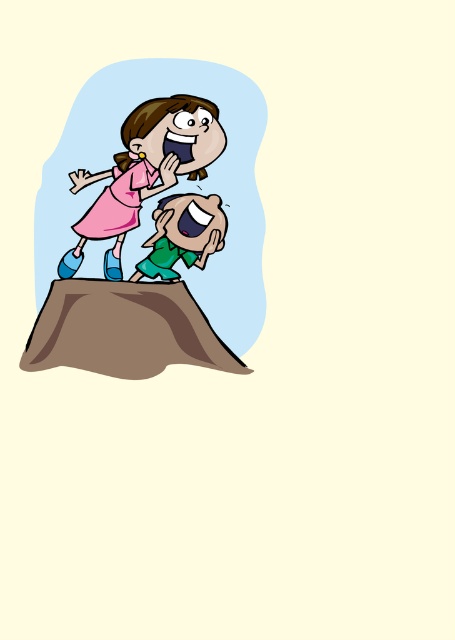
From the picture: Does pink fabric dress at upper center have a lesser width compared to pink matte dress at upper center?

No.

Is pink fabric dress at upper center taller than pink matte dress at upper center?

Yes, pink fabric dress at upper center is taller than pink matte dress at upper center.

This screenshot has height=640, width=455. Find the location of `pink fabric dress at upper center`. pink fabric dress at upper center is located at coordinates (151, 225).